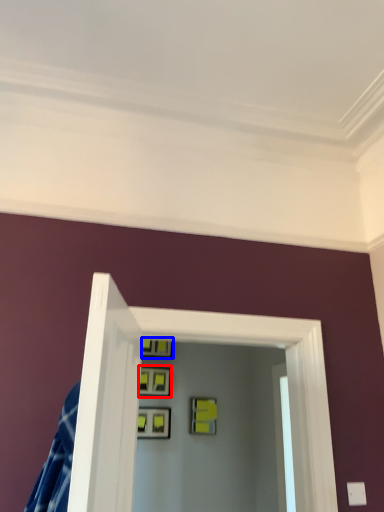
Question: Which point is further to the camera, picture frame (highlighted by a red box) or picture frame (highlighted by a blue box)?

Choices:
 (A) picture frame
 (B) picture frame

Answer: (B)